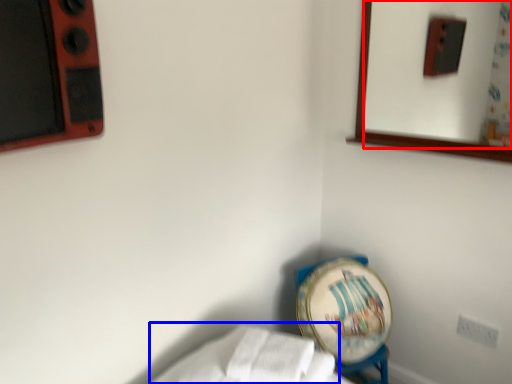
Question: Which point is closer to the camera, mirror (highlighted by a red box) or sheet (highlighted by a blue box)?

Choices:
 (A) mirror
 (B) sheet

Answer: (B)